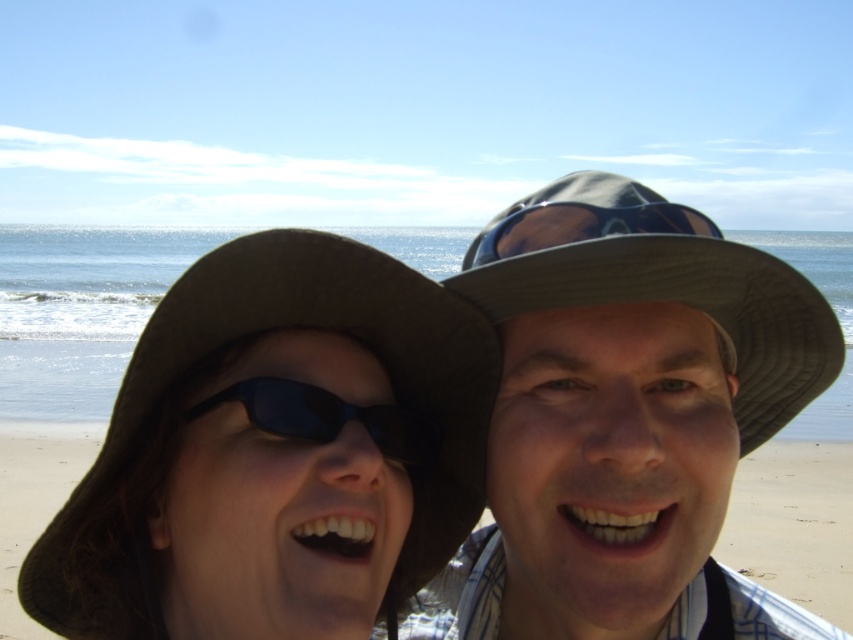
You are designing a display case for beach accessories. The case has two compartments. The first compartment is 20 cm wide, and the second is 15 cm wide. Based on the image, which object from the matte gray hat at center and the matte blue goggles at upper center should go into each compartment to ensure they fit properly?

The matte gray hat at center is bigger than the matte blue goggles at upper center, so the matte gray hat at center should go into the 20 cm wide compartment and the matte blue goggles at upper center into the 15 cm wide one to ensure proper fit.